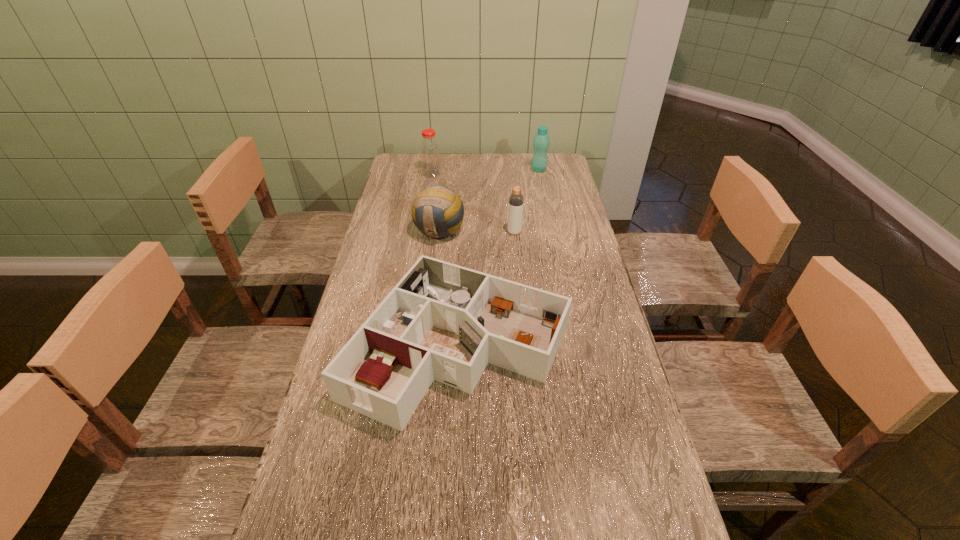
The height and width of the screenshot is (540, 960). I want to click on vacant area that lies between the rightmost bottle and the volleyball, so click(489, 201).

Identify the location of free space between the second bottle from left to right and the leftmost bottle. This screenshot has height=540, width=960. (473, 203).

The width and height of the screenshot is (960, 540). What are the coordinates of `free point between the rightmost bottle and the volleyball` in the screenshot? It's located at (489, 201).

Find the location of a particular element. The width and height of the screenshot is (960, 540). object that is the second closest to the second bottle from left to right is located at coordinates (444, 322).

Identify the location of object that is the closest to the shortest object. (438, 212).

Identify which bottle is located as the second nearest to the rightmost bottle. Please provide its 2D coordinates. Your answer should be formatted as a tuple, i.e. [(x, y)], where the tuple contains the x and y coordinates of a point satisfying the conditions above.

[(516, 200)]

Select which bottle appears as the closest to the nearest object. Please provide its 2D coordinates. Your answer should be formatted as a tuple, i.e. [(x, y)], where the tuple contains the x and y coordinates of a point satisfying the conditions above.

[(516, 200)]

This screenshot has height=540, width=960. I want to click on free spot that satisfies the following two spatial constraints: 1. on the back side of the nearest object; 2. on the right side of the nearest bottle, so click(464, 232).

The height and width of the screenshot is (540, 960). Find the location of `free region that satisfies the following two spatial constraints: 1. on the front side of the nearest bottle; 2. on the right side of the volleyball`. free region that satisfies the following two spatial constraints: 1. on the front side of the nearest bottle; 2. on the right side of the volleyball is located at coordinates (439, 232).

Image resolution: width=960 pixels, height=540 pixels. Identify the location of blank space that satisfies the following two spatial constraints: 1. on the front side of the leftmost bottle; 2. on the left side of the volleyball. coord(422,232).